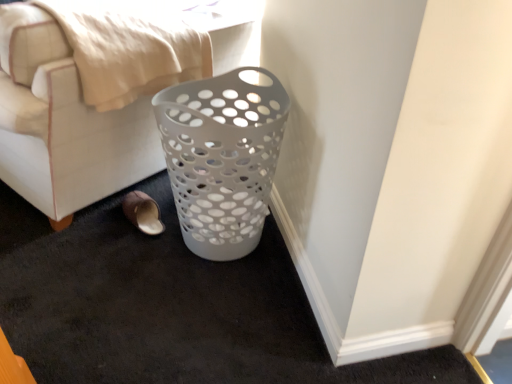
Question: Can you confirm if white plastic basket at lower right is bigger than white plastic laundry basket at lower center?

Choices:
 (A) no
 (B) yes

Answer: (A)

Question: From a real-world perspective, is white plastic basket at lower right located higher than white plastic laundry basket at lower center?

Choices:
 (A) yes
 (B) no

Answer: (B)

Question: Is white plastic basket at lower right surrounding white plastic laundry basket at lower center?

Choices:
 (A) no
 (B) yes

Answer: (A)

Question: Does white plastic basket at lower right have a lesser width compared to white plastic laundry basket at lower center?

Choices:
 (A) yes
 (B) no

Answer: (A)

Question: Is white plastic basket at lower right at the right side of white plastic laundry basket at lower center?

Choices:
 (A) yes
 (B) no

Answer: (A)

Question: Is white plastic basket at lower right beside white plastic laundry basket at lower center?

Choices:
 (A) no
 (B) yes

Answer: (A)

Question: Is brown suede slipper at lower left bigger than white plastic laundry basket at lower center?

Choices:
 (A) no
 (B) yes

Answer: (A)

Question: Does brown suede slipper at lower left lie behind white plastic laundry basket at lower center?

Choices:
 (A) yes
 (B) no

Answer: (A)

Question: From a real-world perspective, is brown suede slipper at lower left physically above white plastic laundry basket at lower center?

Choices:
 (A) no
 (B) yes

Answer: (A)

Question: Is brown suede slipper at lower left positioned far away from white plastic laundry basket at lower center?

Choices:
 (A) no
 (B) yes

Answer: (A)

Question: Is brown suede slipper at lower left oriented away from white plastic laundry basket at lower center?

Choices:
 (A) yes
 (B) no

Answer: (A)

Question: Is brown suede slipper at lower left in front of white plastic laundry basket at lower center?

Choices:
 (A) yes
 (B) no

Answer: (B)

Question: Considering the relative positions of white plastic laundry basket at lower center and white plastic basket at lower right in the image provided, is white plastic laundry basket at lower center to the right of white plastic basket at lower right from the viewer's perspective?

Choices:
 (A) yes
 (B) no

Answer: (B)